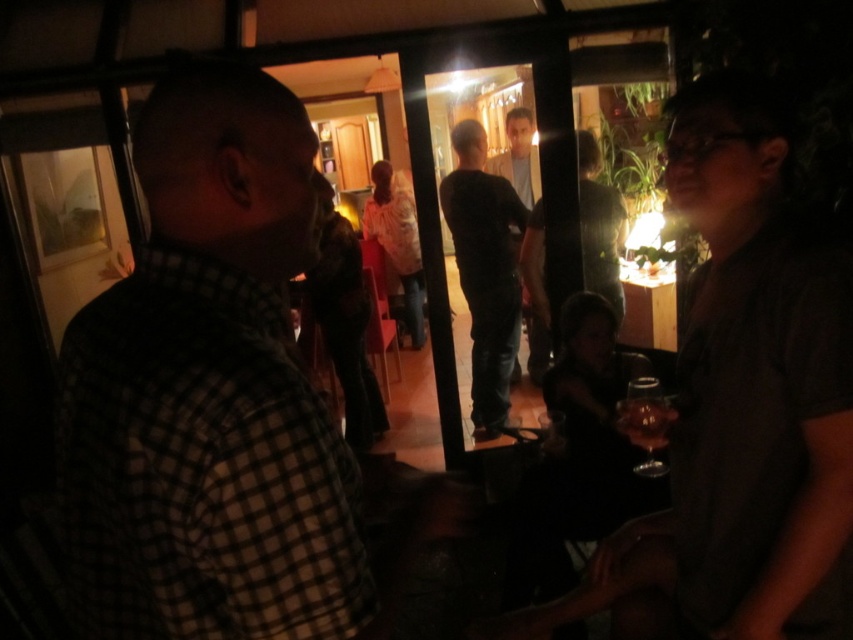
You are at a party and want to approach the person wearing the checkered fabric shirt at left and the dark gray jeans at center. Which piece of clothing should you look for first if you want to find the person quickly?

The checkered fabric shirt at left is positioned on the left side of dark gray jeans at center, so you should look for the checkered fabric shirt at left first as it is located to the left of the dark gray jeans at center.